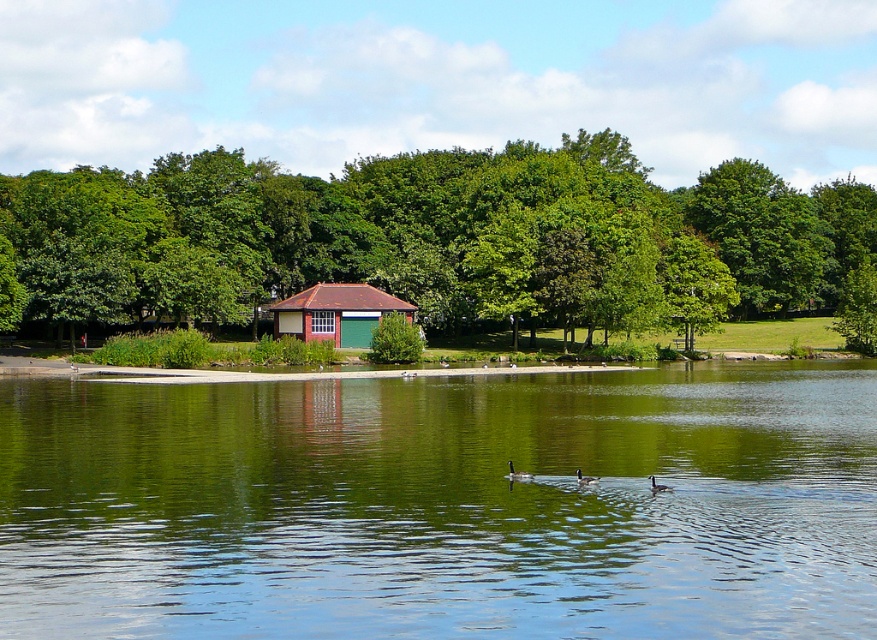
Can you confirm if green reflective water at center is positioned above dark gray matte duck at center?

No, green reflective water at center is not above dark gray matte duck at center.

Can you confirm if green reflective water at center is thinner than dark gray matte duck at center?

No.

Does point (633, 500) come farther from viewer compared to point (592, 480)?

No, it is not.

The image size is (877, 640). Identify the location of green reflective water at center. coord(443,506).

Between point (133, 544) and point (668, 490), which one is positioned in front?

Positioned in front is point (133, 544).

Who is higher up, green reflective water at center or white matte duck at lower center?

Positioned higher is green reflective water at center.

Locate an element on the screen. This screenshot has width=877, height=640. green reflective water at center is located at coordinates (443, 506).

Is point (512, 468) farther from viewer compared to point (653, 484)?

Yes, point (512, 468) is behind point (653, 484).

Who is higher up, brown matte duck at center or white matte duck at lower center?

Positioned higher is brown matte duck at center.

The image size is (877, 640). What do you see at coordinates (517, 474) in the screenshot?
I see `brown matte duck at center` at bounding box center [517, 474].

Locate an element on the screen. brown matte duck at center is located at coordinates (517, 474).